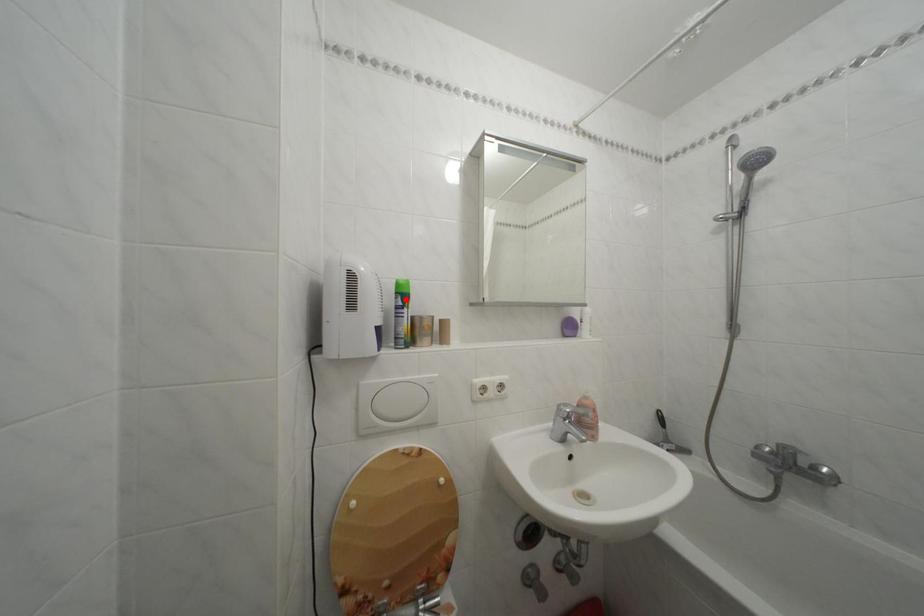
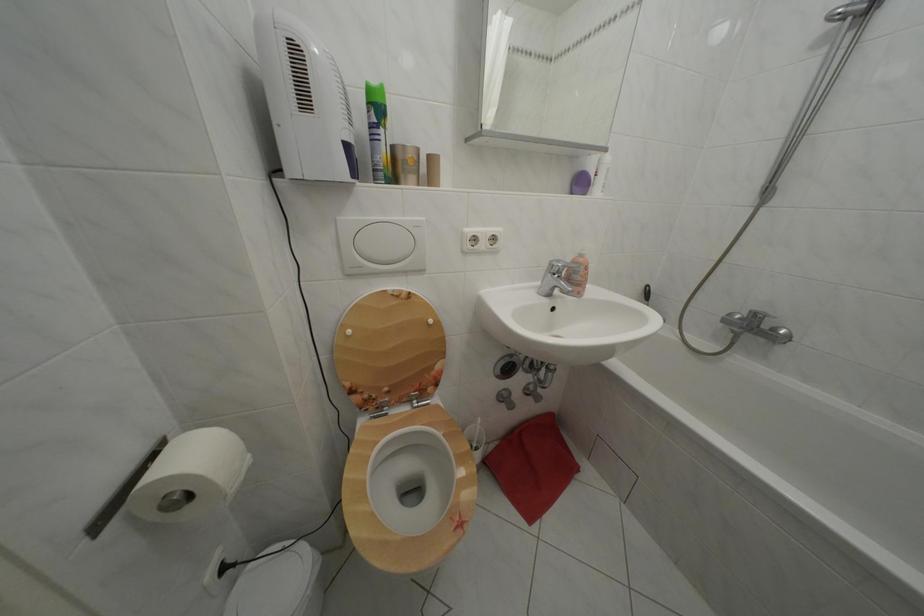
In the second image, find the point that corresponds to the highlighted location in the first image.

(378, 110)